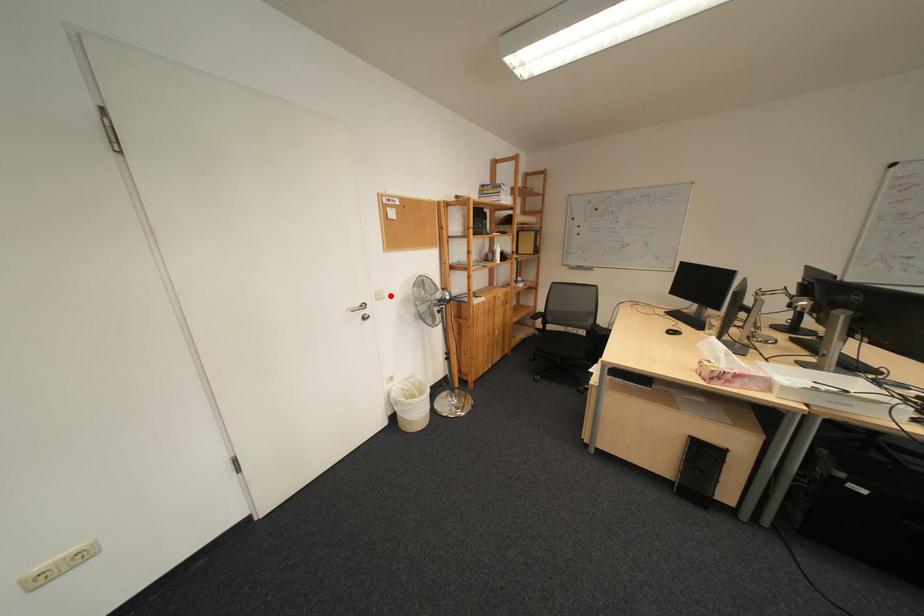
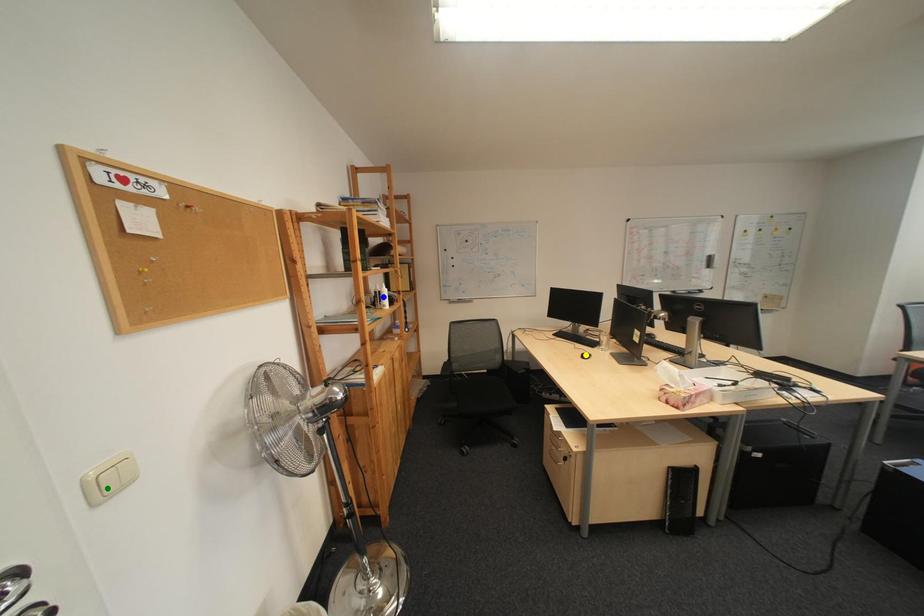
Question: I am providing you with two images of the same scene from different viewpoints. A red point is marked on the first image. You are given multiple points on the second image. Can you choose the point in image 2 that corresponds to the point in image 1?

Choices:
 (A) blue point
 (B) green point
 (C) yellow point

Answer: (B)